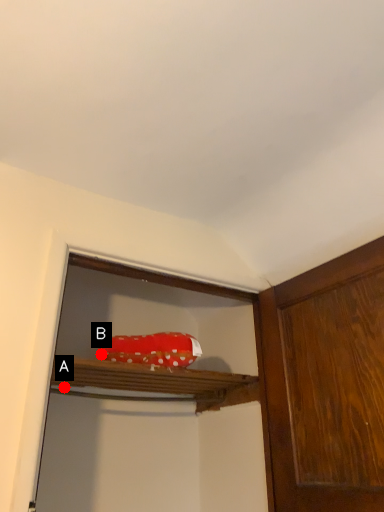
Question: Two points are circled on the image, labeled by A and B beside each circle. Among these points, which one is nearest to the camera?

Choices:
 (A) A is closer
 (B) B is closer

Answer: (B)